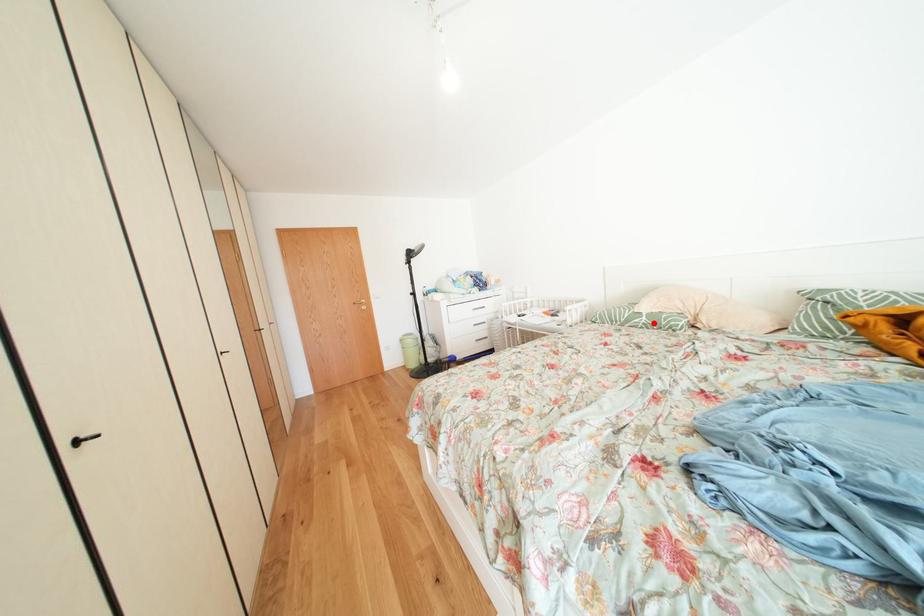
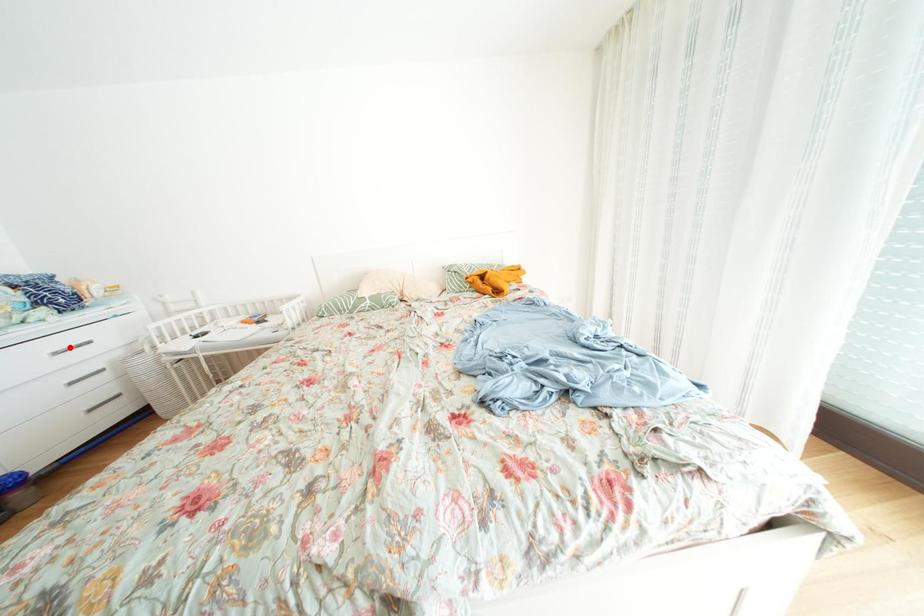
Based on the photo, I am providing you with two images of the same scene from different viewpoints. A red point is marked on the first image and another point is marked on the second image. Is the red point in image1 aligned with the point shown in image2?

No